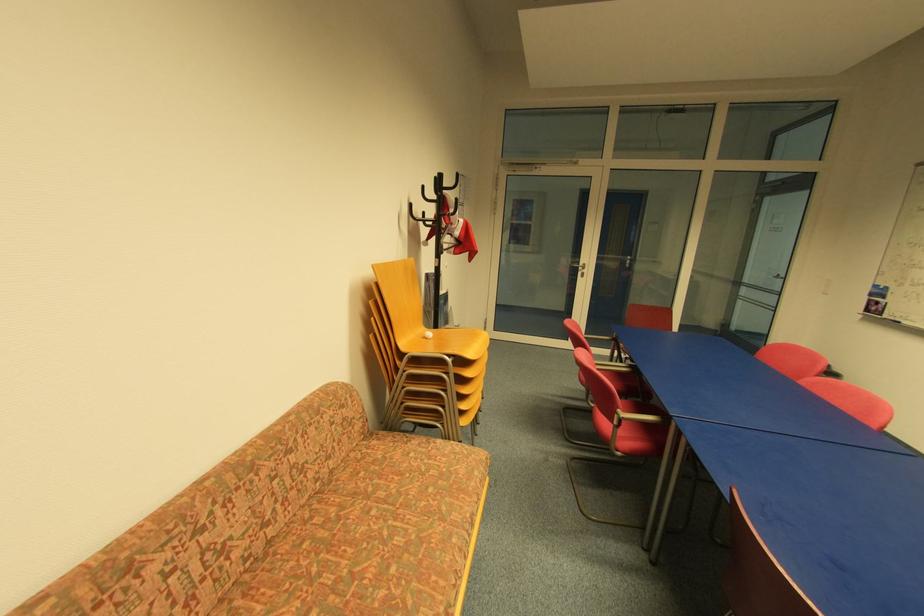
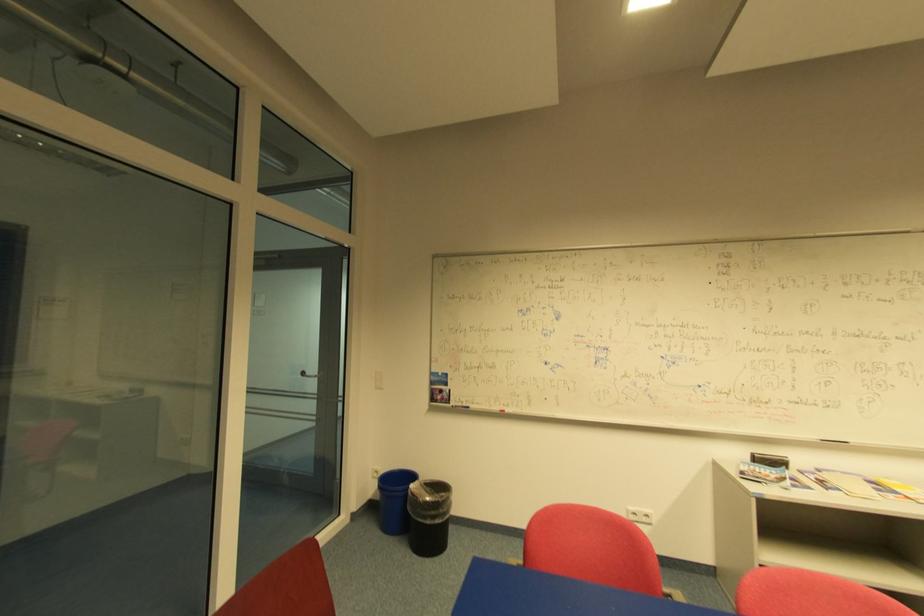
Find the pixel in the second image that matches the point at 783,277 in the first image.

(307, 374)